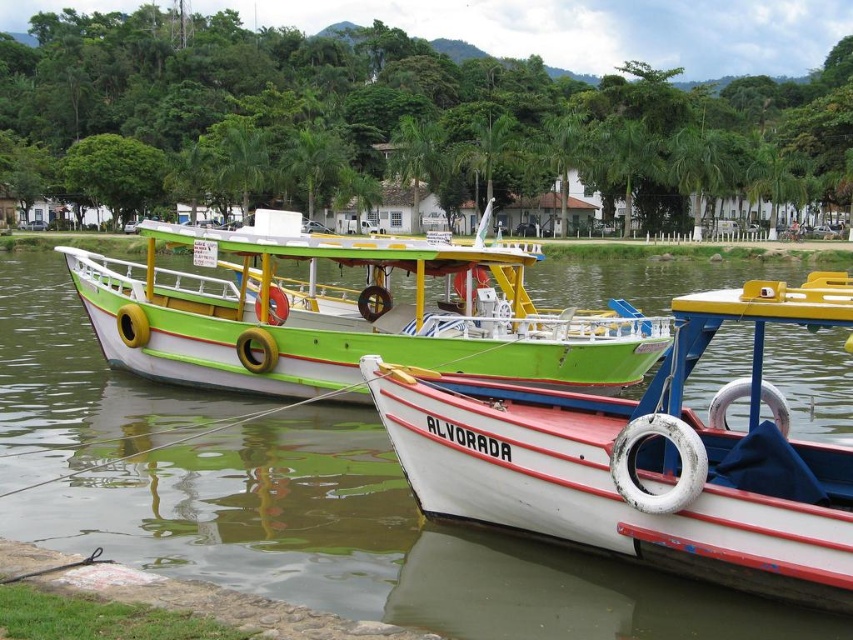
Based on the photo, you are planning to board a boat for a short trip. You have to choose between the white matte boat at lower right and the green matte boat at center. Which boat is bigger and better suited for more passengers?

The green matte boat at center is bigger than the white matte boat at lower right, so it is better suited for more passengers.

You are standing on the riverside path and want to board the white matte boat at lower right. Is the green matte boat at center blocking your path to the boat?

The white matte boat at lower right is in front of the green matte boat at center, so the green matte boat at center is not blocking your path to the white matte boat at lower right.

You are standing on the riverside dock and want to board the white matte boat at lower right. Which direction should you walk from the green matte boat at center to reach it?

The white matte boat at lower right is positioned under the green matte boat at center, so you should walk downward from the green matte boat at center to reach the white matte boat at lower right.